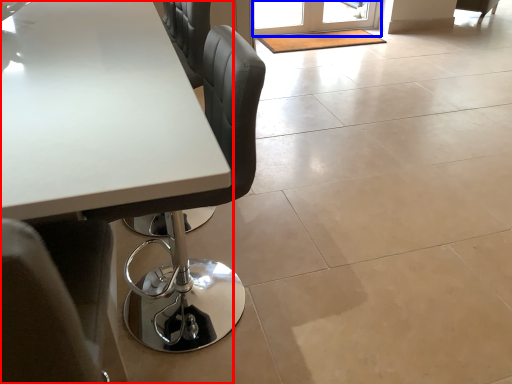
Question: Among these objects, which one is farthest to the camera, table (highlighted by a red box) or screen door (highlighted by a blue box)?

Choices:
 (A) table
 (B) screen door

Answer: (B)